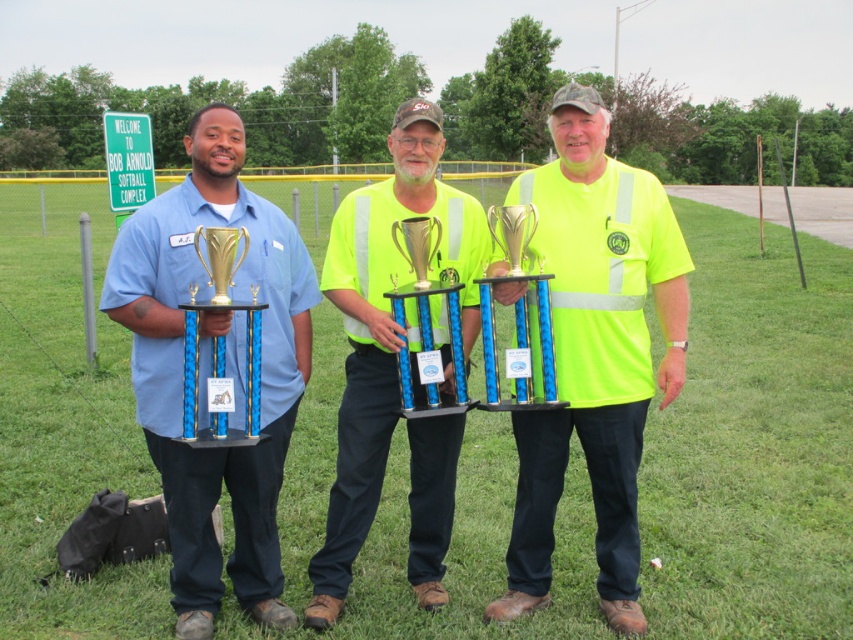
Question: Where is gold metallic trophy at center located in relation to gold shiny trophy at center in the image?

Choices:
 (A) right
 (B) left

Answer: (A)

Question: Does gold metallic trophy at left come behind gold metallic trophy at center?

Choices:
 (A) no
 (B) yes

Answer: (A)

Question: Which of the following is the closest to the observer?

Choices:
 (A) (173, 589)
 (B) (339, 436)

Answer: (A)

Question: Can you confirm if neon yellow reflective safety vest at center is wider than gold metallic trophy at center?

Choices:
 (A) yes
 (B) no

Answer: (A)

Question: Which point appears farthest from the camera in this image?

Choices:
 (A) (326, 525)
 (B) (351, 278)
 (C) (558, 266)
 (D) (120, 273)

Answer: (A)

Question: Which object appears farthest from the camera in this image?

Choices:
 (A) neon yellow reflective shirt at center
 (B) matte blue shirt at center
 (C) high-visibility yellow safety vest at center

Answer: (C)